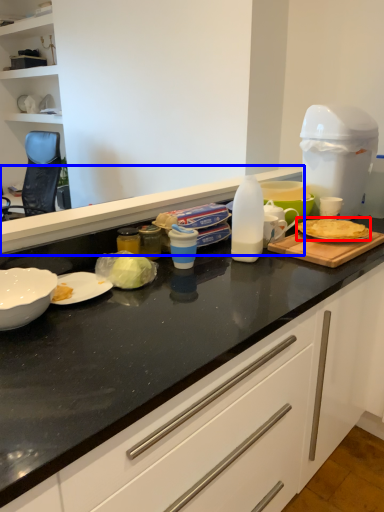
Question: Which of the following is the farthest to the observer, food (highlighted by a red box) or countertop (highlighted by a blue box)?

Choices:
 (A) food
 (B) countertop

Answer: (A)